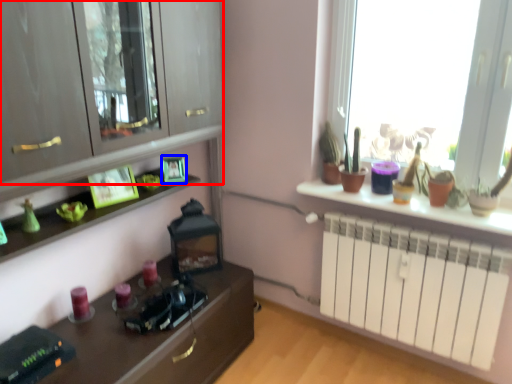
Question: Which object appears closest to the camera in this image, cabinetry (highlighted by a red box) or picture frame (highlighted by a blue box)?

Choices:
 (A) cabinetry
 (B) picture frame

Answer: (A)